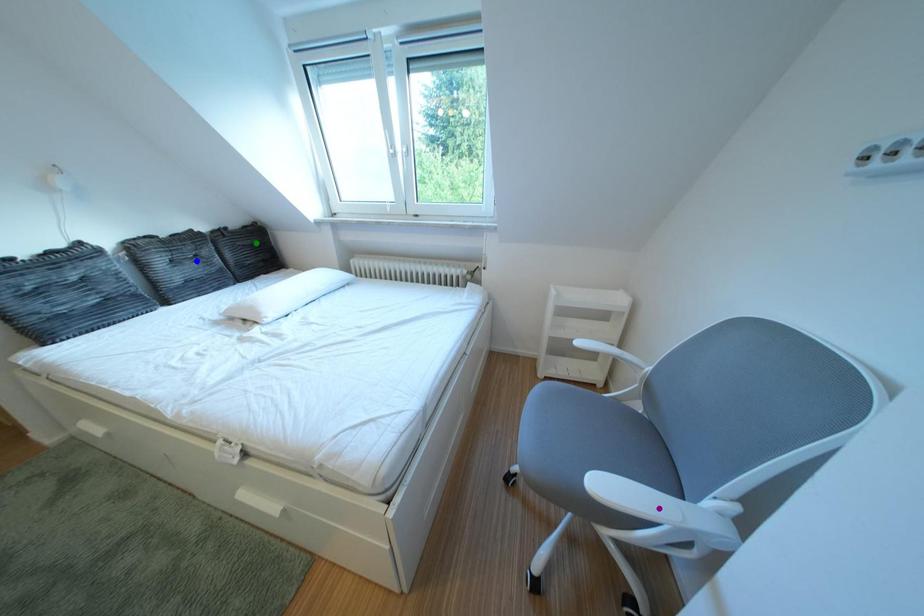
Order these from nearest to farthest:
purple point
blue point
green point

purple point
blue point
green point